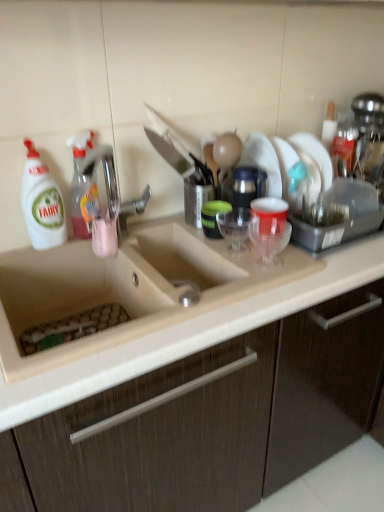
Question: Considering the relative positions of translucent plastic spray bottle at left, positioned as the first cleaning product in right-to-left order, and beige ceramic sink at center in the image provided, is translucent plastic spray bottle at left, positioned as the first cleaning product in right-to-left order, to the left or to the right of beige ceramic sink at center?

Choices:
 (A) left
 (B) right

Answer: (A)

Question: Do you think translucent plastic spray bottle at left, which appears as the 2th cleaning product when viewed from the left, is within beige ceramic sink at center, or outside of it?

Choices:
 (A) inside
 (B) outside

Answer: (B)

Question: Estimate the real-world distances between objects in this image. Which object is closer to the white plastic bottle at left, which is counted as the first cleaning product, starting from the left?

Choices:
 (A) translucent plastic spray bottle at left, positioned as the first cleaning product in right-to-left order
 (B) transparent plastic cup at center, acting as the 2th tableware starting from the back
 (C) beige ceramic sink at center
 (D) matte wood cabinet at center
 (E) translucent plastic cup at sink, positioned as the first tableware in left-to-right order

Answer: (A)

Question: Which object is the closest to the white plastic bottle at left, marked as the 2th cleaning product in a right-to-left arrangement?

Choices:
 (A) transparent plastic cup at center, acting as the 2th tableware starting from the back
 (B) translucent plastic spray bottle at left, positioned as the first cleaning product in right-to-left order
 (C) translucent plastic cup at sink, positioned as the first tableware in left-to-right order
 (D) beige ceramic sink at center
 (E) matte wood cabinet at center

Answer: (B)